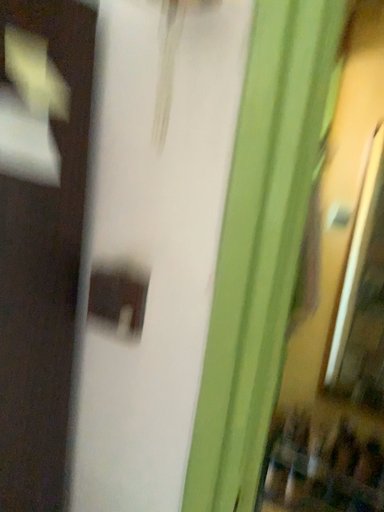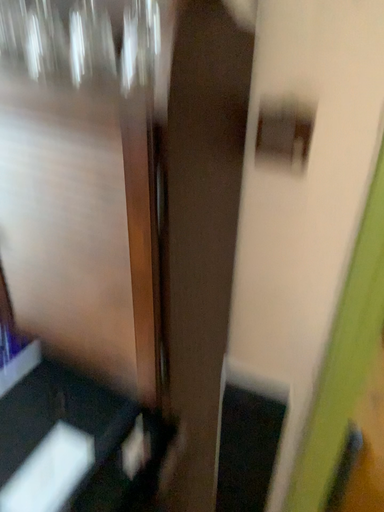
Question: Which way did the camera rotate in the video?

Choices:
 (A) rotated upward
 (B) rotated downward

Answer: (B)